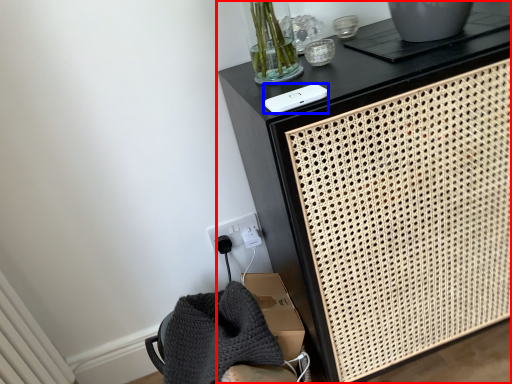
Question: Which of the following is the farthest to the observer, furniture (highlighted by a red box) or ipod (highlighted by a blue box)?

Choices:
 (A) furniture
 (B) ipod

Answer: (B)